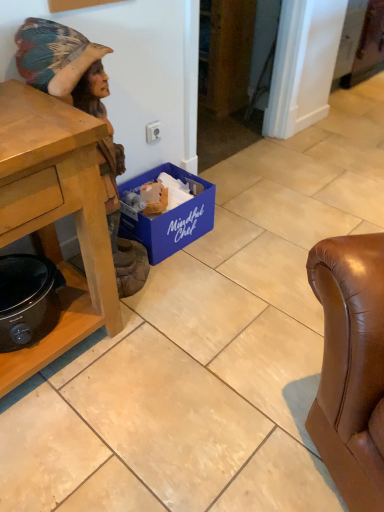
Question: From the image's perspective, does wooden statue at left appear higher than black matte slow cooker at lower left?

Choices:
 (A) yes
 (B) no

Answer: (A)

Question: Can you confirm if wooden statue at left is wider than black matte slow cooker at lower left?

Choices:
 (A) no
 (B) yes

Answer: (B)

Question: Can you confirm if wooden statue at left is positioned to the right of black matte slow cooker at lower left?

Choices:
 (A) yes
 (B) no

Answer: (A)

Question: Is wooden statue at left closer to camera compared to black matte slow cooker at lower left?

Choices:
 (A) yes
 (B) no

Answer: (A)

Question: Would you say wooden statue at left is a long distance from black matte slow cooker at lower left?

Choices:
 (A) yes
 (B) no

Answer: (B)

Question: Is the surface of wooden statue at left in direct contact with black matte slow cooker at lower left?

Choices:
 (A) yes
 (B) no

Answer: (B)

Question: Is black matte slow cooker at lower left shorter than blue cardboard box at lower center?

Choices:
 (A) no
 (B) yes

Answer: (B)

Question: Considering the relative positions of black matte slow cooker at lower left and blue cardboard box at lower center in the image provided, is black matte slow cooker at lower left to the right of blue cardboard box at lower center from the viewer's perspective?

Choices:
 (A) yes
 (B) no

Answer: (B)

Question: Does black matte slow cooker at lower left have a larger size compared to blue cardboard box at lower center?

Choices:
 (A) no
 (B) yes

Answer: (A)

Question: Is black matte slow cooker at lower left aimed at blue cardboard box at lower center?

Choices:
 (A) no
 (B) yes

Answer: (A)

Question: Does black matte slow cooker at lower left have a greater height compared to blue cardboard box at lower center?

Choices:
 (A) no
 (B) yes

Answer: (A)

Question: Is black matte slow cooker at lower left at the left side of blue cardboard box at lower center?

Choices:
 (A) no
 (B) yes

Answer: (B)

Question: Are black matte slow cooker at lower left and wooden statue at left beside each other?

Choices:
 (A) no
 (B) yes

Answer: (A)